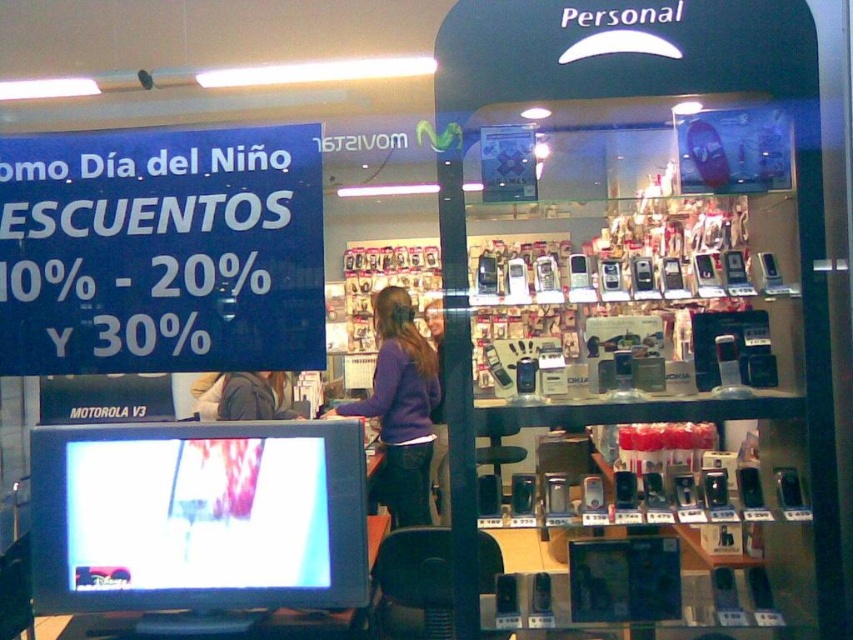
Between point (305, 452) and point (264, 390), which one is positioned in front?

Positioned in front is point (305, 452).

Does matte black monitor at lower left appear on the left side of dark gray jacket at center?

No, matte black monitor at lower left is not to the left of dark gray jacket at center.

The height and width of the screenshot is (640, 853). Find the location of `matte black monitor at lower left`. matte black monitor at lower left is located at coordinates (198, 516).

Locate an element on the screen. The image size is (853, 640). matte black monitor at lower left is located at coordinates (198, 516).

Find the location of a particular element. matte black monitor at lower left is located at coordinates (198, 516).

In the scene shown: Does purple sweater at center have a lesser width compared to dark gray jacket at center?

No, purple sweater at center is not thinner than dark gray jacket at center.

Is purple sweater at center bigger than dark gray jacket at center?

Correct, purple sweater at center is larger in size than dark gray jacket at center.

Measure the distance between purple sweater at center and camera.

4.15 meters

What are the coordinates of `purple sweater at center` in the screenshot? It's located at (401, 406).